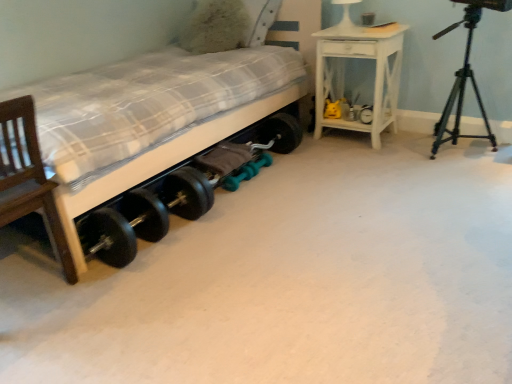
Question: Considering the positions of wooden bed at lower left and wooden chair at left in the image, is wooden bed at lower left bigger or smaller than wooden chair at left?

Choices:
 (A) big
 (B) small

Answer: (A)

Question: Considering the positions of point (258, 117) and point (54, 221), is point (258, 117) closer or farther from the camera than point (54, 221)?

Choices:
 (A) closer
 (B) farther

Answer: (B)

Question: Based on their relative distances, which object is nearer to the wooden bed at lower left?

Choices:
 (A) white glossy table lamp at upper center
 (B) white painted wood nightstand at upper right
 (C) wooden chair at left
 (D) fluffy white pillow at upper center
 (E) black metal tripod at right

Answer: (C)

Question: Which is farther from the white painted wood nightstand at upper right?

Choices:
 (A) wooden bed at lower left
 (B) white glossy table lamp at upper center
 (C) black metal tripod at right
 (D) wooden chair at left
 (E) fluffy white pillow at upper center

Answer: (D)